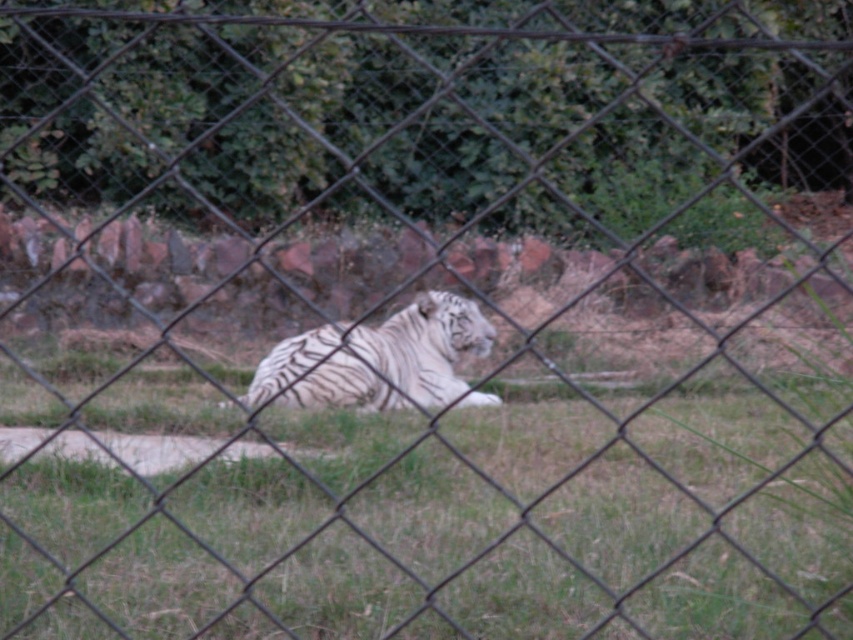
Question: Which point is closer to the camera?

Choices:
 (A) green grass at center
 (B) white striped tiger at center

Answer: (A)

Question: Which point appears farthest from the camera in this image?

Choices:
 (A) (440, 339)
 (B) (628, 593)

Answer: (A)

Question: Is green grass at center positioned behind white striped tiger at center?

Choices:
 (A) no
 (B) yes

Answer: (A)

Question: Which of the following is the closest to the observer?

Choices:
 (A) white striped tiger at center
 (B) green grass at center

Answer: (B)

Question: Can you confirm if green grass at center is positioned below white striped tiger at center?

Choices:
 (A) yes
 (B) no

Answer: (A)

Question: Considering the relative positions of green grass at center and white striped tiger at center in the image provided, where is green grass at center located with respect to white striped tiger at center?

Choices:
 (A) below
 (B) above

Answer: (A)